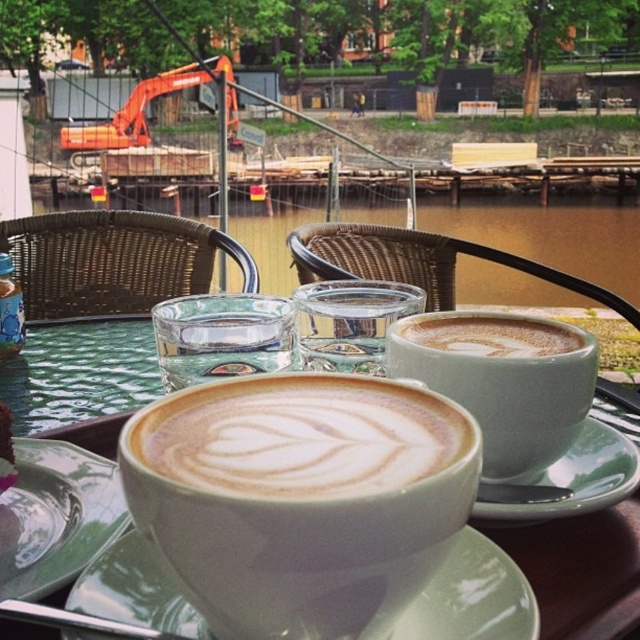
Can you confirm if matte ceramic cup at center is positioned to the right of matte ceramic cups at center?

Correct, you'll find matte ceramic cup at center to the right of matte ceramic cups at center.

Is matte ceramic cup at center wider than matte ceramic cups at center?

In fact, matte ceramic cup at center might be narrower than matte ceramic cups at center.

At what (x,y) coordinates should I click in order to perform the action: click on matte ceramic cup at center. Please return your answer as a coordinate pair (x, y). This screenshot has width=640, height=640. Looking at the image, I should click on (502, 380).

Is matte ceramic cups at center behind matte ceramic platter at center?

That is False.

Which of these two, matte ceramic cups at center or matte ceramic platter at center, stands taller?

matte ceramic cups at center is taller.

Where is `matte ceramic cups at center`? matte ceramic cups at center is located at coordinates (579, 570).

Which is more to the left, matte ceramic cups at center or white glossy saucer at center?

white glossy saucer at center

Image resolution: width=640 pixels, height=640 pixels. What do you see at coordinates (579, 570) in the screenshot? I see `matte ceramic cups at center` at bounding box center [579, 570].

Locate an element on the screen. The width and height of the screenshot is (640, 640). matte ceramic cups at center is located at coordinates (579, 570).